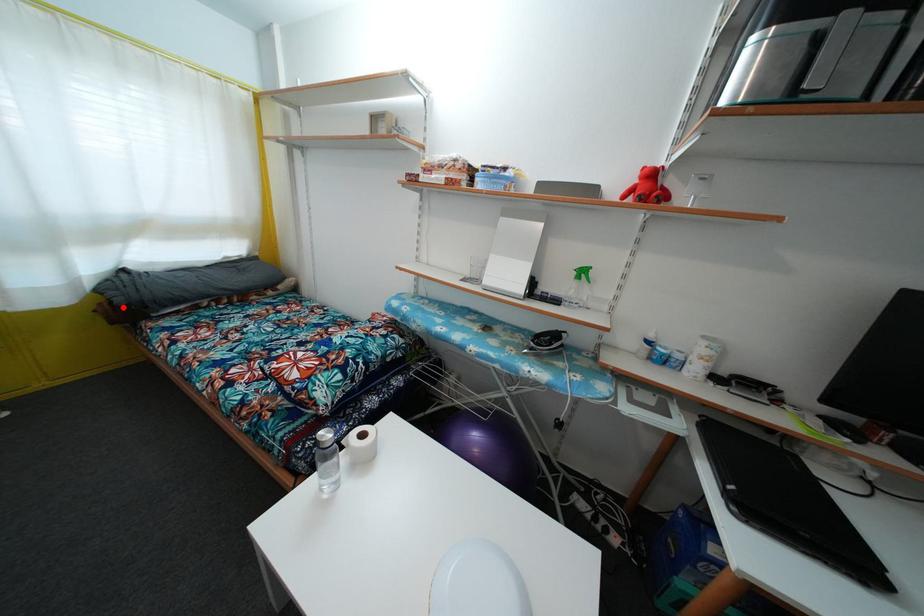
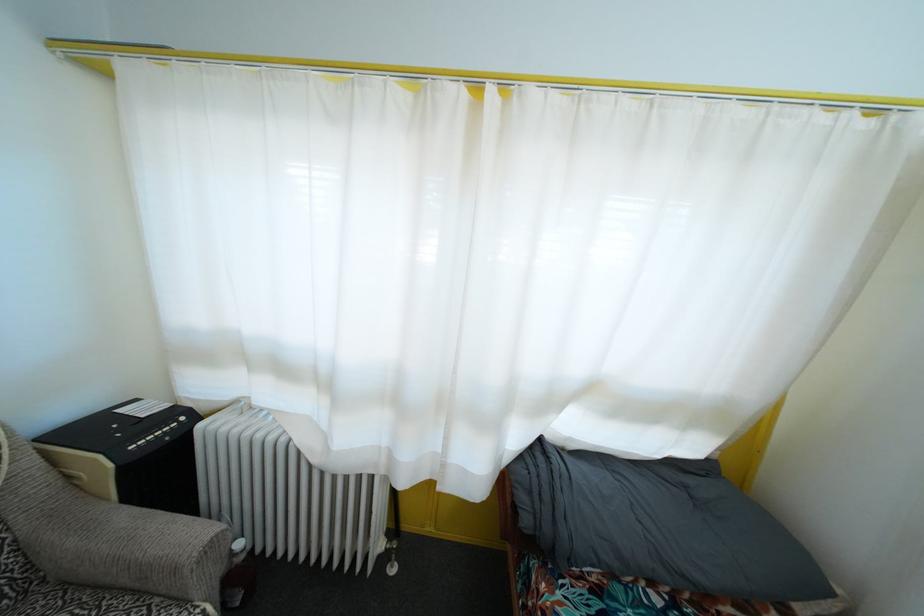
Question: I am providing you with two images of the same scene from different viewpoints. Image1 has a red point marked. In image2, the corresponding 3D location appears at what relative position? Reply with the corresponding letter.

Choices:
 (A) Closer
 (B) Farther

Answer: (B)